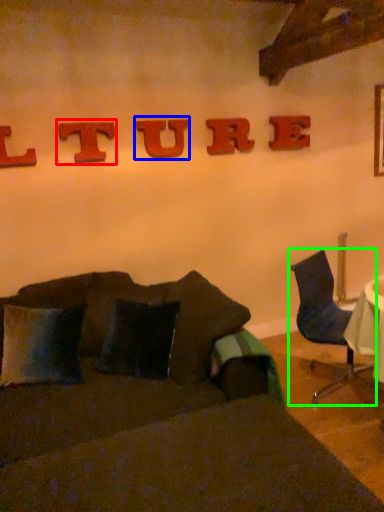
Question: Which is nearer to the alphabet (highlighted by a red box)? alphabet (highlighted by a blue box) or chair (highlighted by a green box).

Choices:
 (A) alphabet
 (B) chair

Answer: (A)